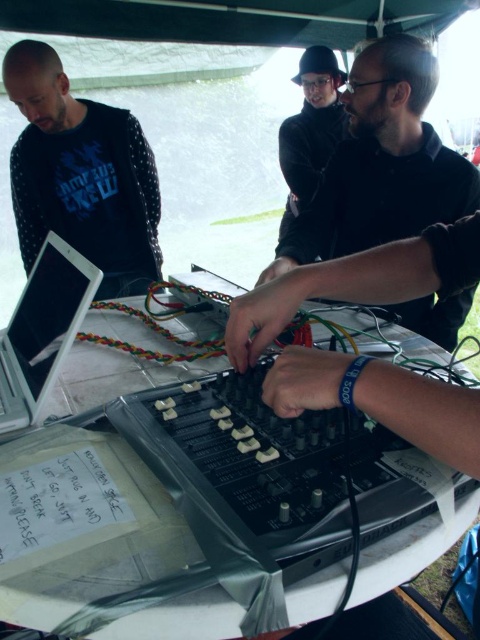
Question: Does black matte headphones at upper center have a lesser width compared to white plastic table at center?

Choices:
 (A) yes
 (B) no

Answer: (A)

Question: Does black matte headphones at upper center appear over white plastic table at center?

Choices:
 (A) yes
 (B) no

Answer: (A)

Question: Among these points, which one is nearest to the camera?

Choices:
 (A) (218, 288)
 (B) (315, 212)
 (C) (96, 168)
 (D) (55, 346)

Answer: (D)

Question: Can you confirm if black matte headphones at upper center is positioned below black dotted sweatshirt at upper left?

Choices:
 (A) yes
 (B) no

Answer: (A)

Question: Which object appears closest to the camera in this image?

Choices:
 (A) white plastic table at center
 (B) white glossy laptop at center
 (C) black matte headphones at upper center
 (D) black dotted sweatshirt at upper left

Answer: (A)

Question: Which point is farther to the camera?

Choices:
 (A) (16, 349)
 (B) (144, 156)
 (C) (83, 401)
 (D) (384, 173)

Answer: (B)